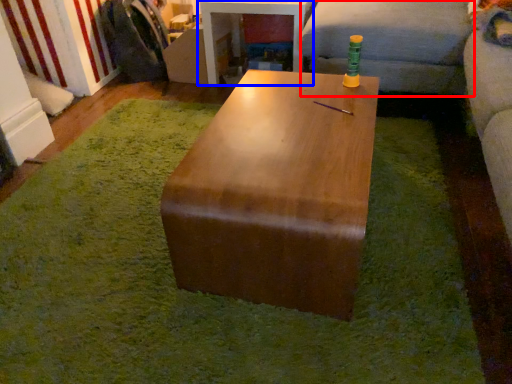
Question: Which object is closer to the camera taking this photo, couch (highlighted by a red box) or table (highlighted by a blue box)?

Choices:
 (A) couch
 (B) table

Answer: (A)